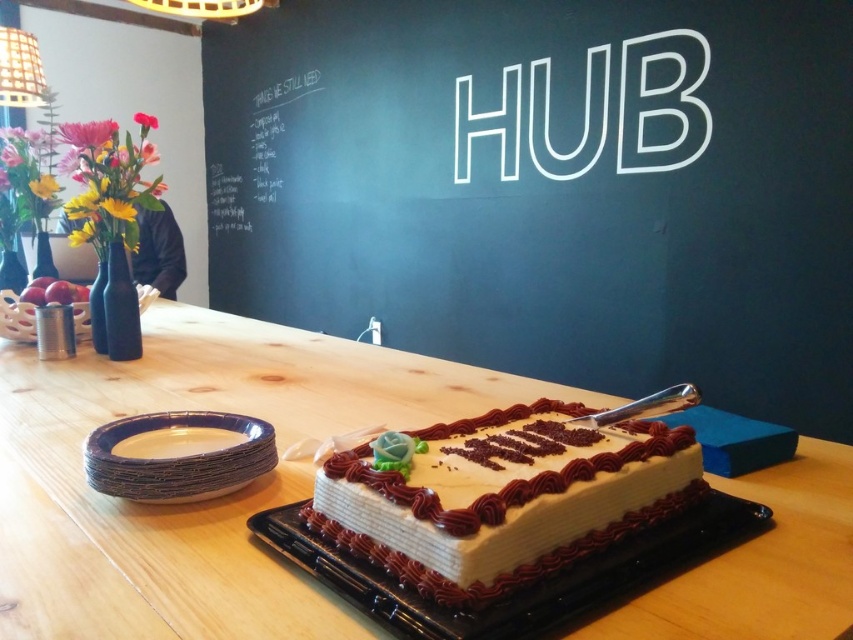
You are standing in the celebratory scene and want to place a decorative item on the matte black chalkboard at center. Based on the scene description, where exactly should you position it?

The matte black chalkboard at center is located at coordinates point [549,188], so you should place the decorative item at that specific 2D location.

You are planning to hang a new picture frame that is 1.2 meters tall. You want to place it in the same area as the matte black chalkboard at center and the white chalkboard at upper left. Considering their heights, which chalkboard should you avoid placing the frame next to to prevent it from looking too small in comparison?

The matte black chalkboard at center has a greater height compared to the white chalkboard at upper left. Therefore, you should avoid placing the frame next to the matte black chalkboard at center to prevent it from appearing too small in comparison.